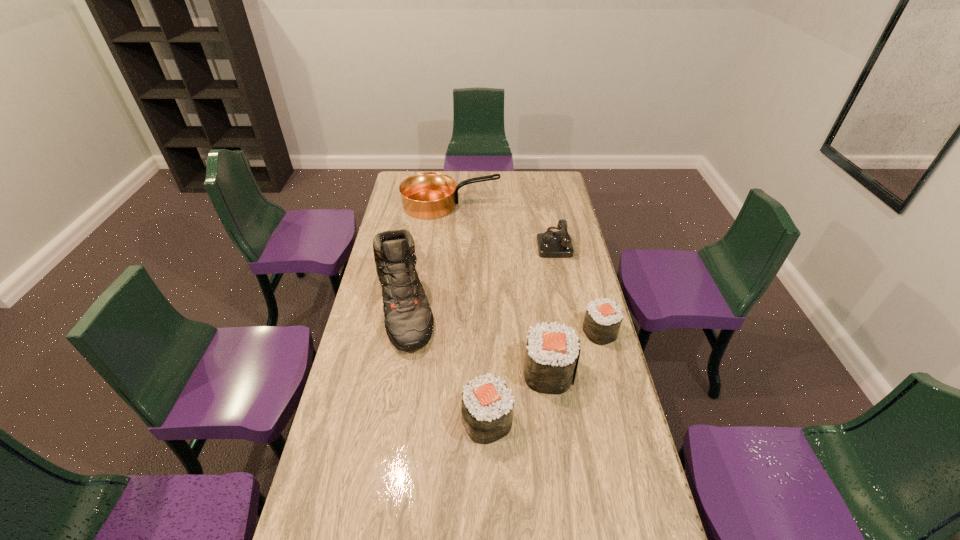
The image size is (960, 540). I want to click on the fourth tallest object, so click(487, 406).

Where is `the nearest object`? the nearest object is located at coordinates (487, 406).

Image resolution: width=960 pixels, height=540 pixels. Identify the location of the second nearest sushi. (552, 354).

Find the location of a particular element. The image size is (960, 540). the shortest sushi is located at coordinates pyautogui.click(x=603, y=318).

The width and height of the screenshot is (960, 540). What are the coordinates of `the farthest sushi` in the screenshot? It's located at (603, 318).

Locate an element on the screen. This screenshot has height=540, width=960. the fifth nearest object is located at coordinates (552, 244).

This screenshot has height=540, width=960. In order to click on frying pan in this screenshot , I will do `click(429, 195)`.

I want to click on the tallest object, so click(409, 321).

Identify the location of free location located on the back of the leftmost sushi. This screenshot has width=960, height=540. (486, 320).

You are a GUI agent. You are given a task and a screenshot of the screen. Output one action in this format:
    pyautogui.click(x=<x>, y=<y>)
    Task: Click on the free space located 0.250m on the front of the second sushi from left to right
    Image resolution: width=960 pixels, height=540 pixels.
    Given the screenshot: What is the action you would take?
    pyautogui.click(x=563, y=474)